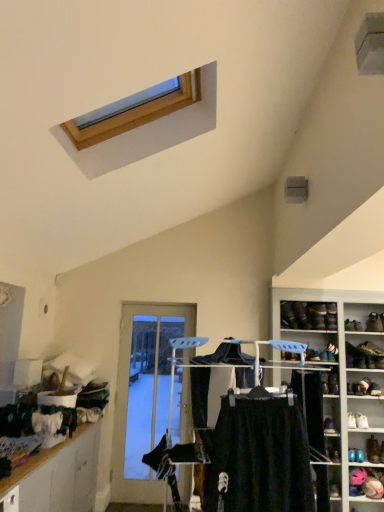
The width and height of the screenshot is (384, 512). Describe the element at coordinates (288, 316) in the screenshot. I see `black leather shoe at upper right, the 1th shoe positioned from the left` at that location.

The image size is (384, 512). What do you see at coordinates (373, 450) in the screenshot?
I see `matte brown shoe at lower right, positioned as the 1th shoe in bottom-to-top order` at bounding box center [373, 450].

Find the location of `black leather shoe at upper right, marked as the first shoe in a top-to-bottom arrangement`. black leather shoe at upper right, marked as the first shoe in a top-to-bottom arrangement is located at coordinates (301, 315).

You are a GUI agent. You are given a task and a screenshot of the screen. Output one action in this format:
    pyautogui.click(x=<x>, y=<y>)
    Task: Click on the black matte skirt at center
    This screenshot has width=384, height=512.
    Given the screenshot: What is the action you would take?
    pyautogui.click(x=260, y=458)

From a real-world perspective, between black leather shoe at upper right, the 7th shoe positioned from the bottom, and matte brown shoe at lower right, the second shoe in the right-to-left sequence, who is vertically higher?

black leather shoe at upper right, the 7th shoe positioned from the bottom, from a real-world perspective.

Is black leather shoe at upper right, acting as the second shoe starting from the left, spatially inside matte brown shoe at lower right, the seventh shoe when ordered from top to bottom, or outside of it?

black leather shoe at upper right, acting as the second shoe starting from the left, lies outside matte brown shoe at lower right, the seventh shoe when ordered from top to bottom.

Is point (298, 318) closer or farther from the camera than point (375, 460)?

Point (298, 318) appears to be farther away from the viewer than point (375, 460).

Identify the location of the 6th shoe above when counting from the matte brown shoe at lower right, positioned as the 1th shoe in bottom-to-top order (from the image's perspective). This screenshot has width=384, height=512. (301, 315).

Considering the positions of objects matte black shoe at upper right, the fifth shoe in the left-to-right sequence, and leather brown shoe at center right, placed as the 3th shoe when sorted from bottom to top, in the image provided, who is behind, matte black shoe at upper right, the fifth shoe in the left-to-right sequence, or leather brown shoe at center right, placed as the 3th shoe when sorted from bottom to top,?

Positioned behind is matte black shoe at upper right, the fifth shoe in the left-to-right sequence.

Is matte black shoe at upper right, the fifth shoe in the left-to-right sequence, to the left or to the right of leather brown shoe at center right, placed as the 3th shoe when sorted from bottom to top, in the image?

matte black shoe at upper right, the fifth shoe in the left-to-right sequence, is positioned on leather brown shoe at center right, placed as the 3th shoe when sorted from bottom to top,'s right side.

Between matte black shoe at upper right, which appears as the third shoe when viewed from the right, and leather brown shoe at center right, placed as the 3th shoe when sorted from bottom to top, which one has more height?

matte black shoe at upper right, which appears as the third shoe when viewed from the right.

Are matte black shoe at upper right, which appears as the third shoe when viewed from the right, and leather brown shoe at center right, placed as the fifth shoe when sorted from top to bottom, beside each other?

There is a gap between matte black shoe at upper right, which appears as the third shoe when viewed from the right, and leather brown shoe at center right, placed as the fifth shoe when sorted from top to bottom.

Does black matte skirt at center have a lesser height compared to leather shoe at right, the sixth shoe positioned from the top?

No, black matte skirt at center is not shorter than leather shoe at right, the sixth shoe positioned from the top.

From a real-world perspective, is black matte skirt at center positioned over leather shoe at right, which is counted as the 1th shoe, starting from the right, based on gravity?

Correct, in the physical world, black matte skirt at center is higher than leather shoe at right, which is counted as the 1th shoe, starting from the right.

From the image's perspective, would you say black matte skirt at center is shown under leather shoe at right, the sixth shoe positioned from the top?

Incorrect, from the image's perspective, black matte skirt at center is higher than leather shoe at right, the sixth shoe positioned from the top.

Can you confirm if black matte skirt at center is thinner than leather shoe at right, which is counted as the 1th shoe, starting from the right?

Yes.

Between black fabric clothes at center and shiny black shoe at upper right, which is the 3th footwear in bottom-to-top order, which one has smaller width?

Thinner between the two is shiny black shoe at upper right, which is the 3th footwear in bottom-to-top order.

Is black fabric clothes at center directly adjacent to shiny black shoe at upper right, which is the 3th footwear in bottom-to-top order?

black fabric clothes at center and shiny black shoe at upper right, which is the 3th footwear in bottom-to-top order, are clearly separated.

Could you tell me if black fabric clothes at center is turned towards shiny black shoe at upper right, which is the 3th footwear in bottom-to-top order?

No, black fabric clothes at center does not turn towards shiny black shoe at upper right, which is the 3th footwear in bottom-to-top order.

From the image's perspective, who appears lower, leather shoe at right, acting as the second shoe starting from the bottom, or clear glass door at center?

clear glass door at center is shown below in the image.

Looking at their sizes, would you say leather shoe at right, which is the seventh shoe in left-to-right order, is wider or thinner than clear glass door at center?

leather shoe at right, which is the seventh shoe in left-to-right order, is wider than clear glass door at center.

Between point (372, 393) and point (178, 315), which one is positioned behind?

Positioned behind is point (178, 315).

From the clear glass door at center, count 7th shoe to the right and point to it. Please provide its 2D coordinates.

[(374, 389)]

Looking at this image, from a real-world perspective, which object stands above the other?

In real-world perspective, black leather shoe at upper right, placed as the 5th footwear when sorted from bottom to top, is above.

How different are the orientations of black leather shoe at upper right, placed as the 5th footwear when sorted from bottom to top, and matte brown shoe at lower right, the second shoe in the right-to-left sequence, in degrees?

19.1 degrees.

Does black leather shoe at upper right, placed as the 5th footwear when sorted from bottom to top, appear on the left side of matte brown shoe at lower right, the sixth shoe positioned from the left?

Incorrect, black leather shoe at upper right, placed as the 5th footwear when sorted from bottom to top, is not on the left side of matte brown shoe at lower right, the sixth shoe positioned from the left.

From the image's perspective, is black leather shoe at upper right, placed as the 5th footwear when sorted from bottom to top, positioned above or below matte brown shoe at lower right, the sixth shoe positioned from the left?

black leather shoe at upper right, placed as the 5th footwear when sorted from bottom to top, is situated higher than matte brown shoe at lower right, the sixth shoe positioned from the left, in the image.

Is the surface of black matte skirt at center in direct contact with velvet pink hat at lower right, the second shelf from the top?

No, black matte skirt at center is not touching velvet pink hat at lower right, the second shelf from the top.

Based on the photo, how many degrees apart are the facing directions of black matte skirt at center and velvet pink hat at lower right, which is counted as the second shelf, starting from the left?

The facing directions of black matte skirt at center and velvet pink hat at lower right, which is counted as the second shelf, starting from the left, are 3.94 degrees apart.

The image size is (384, 512). There is a black matte skirt at center. Find the location of `the 2nd shelf below it (from the image's perspective)`. the 2nd shelf below it (from the image's perspective) is located at coordinates (367, 482).

From a real-world perspective, which object stands above the other?

black matte skirt at center is physically above.

This screenshot has width=384, height=512. There is a black leather shoe at upper right, the 7th shoe positioned from the bottom. Find the location of `the 6th shoe below it (from a real-world perspective)`. the 6th shoe below it (from a real-world perspective) is located at coordinates pos(373,450).

Identify the location of the 1st shoe directly above the leather brown shoe at center right, acting as the 5th shoe starting from the right (from a real-world perspective). The image size is (384, 512). (353, 325).

Which object lies nearer to the anchor point black fabric clothes at center, leather boot at right, arranged as the second footwear when viewed from the top, or white leather shoe at lower right, which is the 4th footwear in top-to-bottom order?

Based on the image, leather boot at right, arranged as the second footwear when viewed from the top, appears to be nearer to black fabric clothes at center.

Based on their spatial positions, is leather boot at right, which is the fourth footwear in bottom-to-top order, or matte black shoe at upper right, positioned as the 4th shoe in bottom-to-top order, further from velvet pink hat at lower right, which appears as the first shelf when viewed from the right?

Among the two, matte black shoe at upper right, positioned as the 4th shoe in bottom-to-top order, is located further to velvet pink hat at lower right, which appears as the first shelf when viewed from the right.

From the image, which object appears to be nearer to black leather shoe at upper right, placed as the 5th footwear when sorted from bottom to top, leather boot at right, arranged as the second footwear when viewed from the top, or wooden shoe rack at right, which appears as the 2th shelf when viewed from the right?

leather boot at right, arranged as the second footwear when viewed from the top, is positioned closer to the anchor black leather shoe at upper right, placed as the 5th footwear when sorted from bottom to top.

From the image, which object appears to be nearer to black matte skirt at center, velvet pink hat at lower right, which appears as the first shelf when viewed from the right, or shiny black shoe at upper right, the third footwear when ordered from top to bottom?

velvet pink hat at lower right, which appears as the first shelf when viewed from the right, is positioned closer to the anchor black matte skirt at center.

Estimate the real-world distances between objects in this image. Which object is further from black leather shoe at upper right, acting as the second shoe starting from the left, wooden shoe rack at right, the first shelf positioned from the top, or wooden cabinet at lower left?

wooden cabinet at lower left is positioned further to the anchor black leather shoe at upper right, acting as the second shoe starting from the left.

From the image, which object appears to be farther from black fabric clothes at center, black leather shoe at upper right, placed as the 5th footwear when sorted from bottom to top, or matte black shoe at upper right, which is the fourth shoe in top-to-bottom order?

Among the two, black leather shoe at upper right, placed as the 5th footwear when sorted from bottom to top, is located further to black fabric clothes at center.

From the image, which object appears to be farther from black matte skirt at center, matte brown shoe at lower right, the seventh shoe when ordered from top to bottom, or black fabric clothes at center?

matte brown shoe at lower right, the seventh shoe when ordered from top to bottom, is positioned further to the anchor black matte skirt at center.

From the image, which object appears to be nearer to leather shoe at right, the sixth shoe positioned from the top, black leather shoe at upper right, the 1th shoe positioned from the left, or shiny black shoe at upper right, which is the 3th footwear in bottom-to-top order?

shiny black shoe at upper right, which is the 3th footwear in bottom-to-top order.

Find the location of a particular element. clothing between black fabric clothes at center and black leather shoe at upper right, the 1th shoe positioned from the left, from front to back is located at coordinates (260, 458).

At what (x,y) coordinates should I click in order to perform the action: click on shelf located between wooden cabinet at lower left and matte black shoe at upper right, which appears as the third shoe when viewed from the right, in the left-right direction. Please return your answer as a coordinate pair (x, y). The image size is (384, 512). Looking at the image, I should click on (343, 392).

Image resolution: width=384 pixels, height=512 pixels. What are the coordinates of `closet situated between wooden cabinet at lower left and white leather shoe at lower right, acting as the 2th footwear starting from the bottom, from left to right` in the screenshot? It's located at (262, 455).

Find the location of a particular element. cabinetry between black fabric clothes at center and black leather shoe at upper right, marked as the first shoe in a top-to-bottom arrangement, along the z-axis is located at coordinates (59, 475).